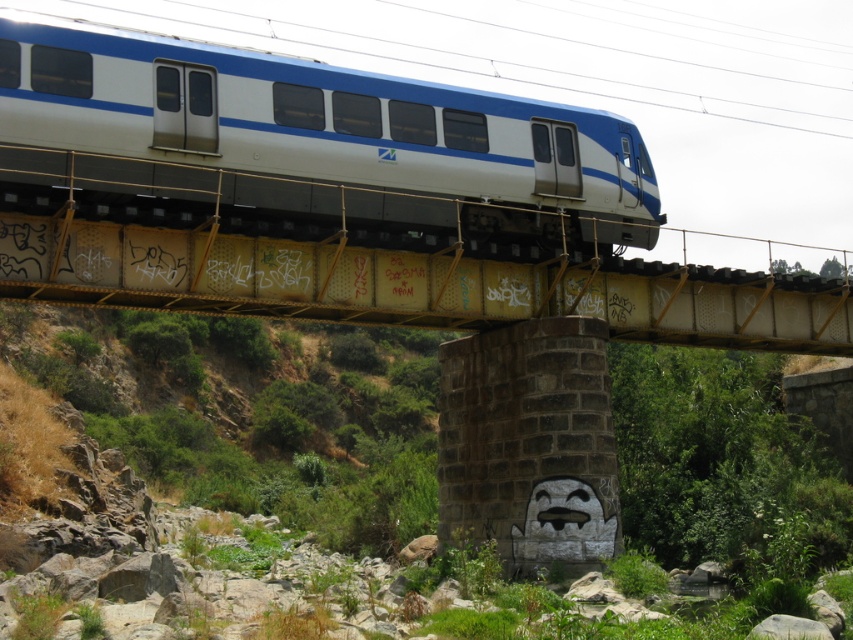
You are standing on the green grassy hillside at lower left and want to board the white glossy train at center. Which direction should you move to reach the train?

Since the green grassy hillside at lower left is closer to the viewer than the white glossy train at center, you would need to move forward towards the train to reach it.